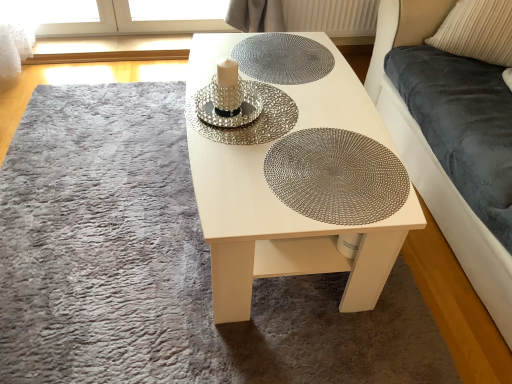
This screenshot has width=512, height=384. What are the coordinates of `vacant space that is in between metallic woven placemat at center, placed as the third glass plate when sorted from top to bottom, and silver metallic plate at center, arranged as the second glass plate when ordered from the bottom` in the screenshot? It's located at (278, 138).